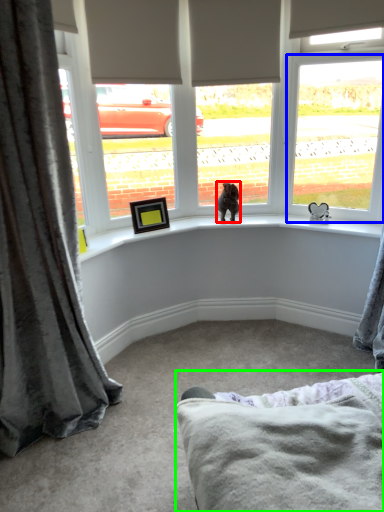
Question: Which is nearer to the animal (highlighted by a red box)? window (highlighted by a blue box) or bedding (highlighted by a green box).

Choices:
 (A) window
 (B) bedding

Answer: (A)